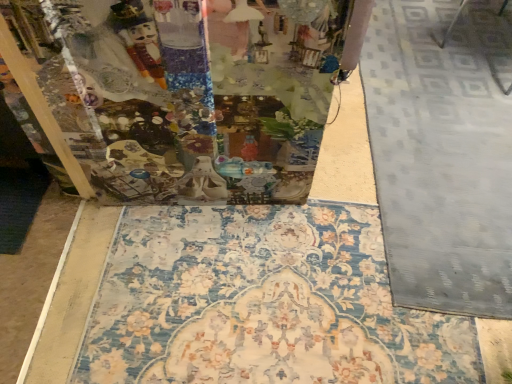
Find the location of a particular element. The width and height of the screenshot is (512, 384). gray textured rug at right is located at coordinates [x=439, y=161].

What do you see at coordinates (439, 161) in the screenshot?
I see `gray textured rug at right` at bounding box center [439, 161].

Where is `floral carpet at center`? floral carpet at center is located at coordinates (262, 303).

What do you see at coordinates (262, 303) in the screenshot? This screenshot has height=384, width=512. I see `floral carpet at center` at bounding box center [262, 303].

Find the location of a particular element. This screenshot has width=512, height=384. gray textured rug at right is located at coordinates (439, 161).

Looking at this image, between floral carpet at center and gray textured rug at right, which one appears on the right side from the viewer's perspective?

gray textured rug at right is more to the right.

Which is behind, floral carpet at center or gray textured rug at right?

gray textured rug at right is behind.

Which point is more forward, (158,223) or (391,289)?

The point (391,289) is closer.

From the image's perspective, which is above, floral carpet at center or gray textured rug at right?

gray textured rug at right, from the image's perspective.

Based on the photo, from a real-world perspective, is floral carpet at center under gray textured rug at right?

Indeed, from a real-world perspective, floral carpet at center is positioned beneath gray textured rug at right.

Considering the sizes of floral carpet at center and gray textured rug at right in the image, is floral carpet at center wider or thinner than gray textured rug at right?

Clearly, floral carpet at center has more width compared to gray textured rug at right.

Is floral carpet at center shorter than gray textured rug at right?

Yes, floral carpet at center is shorter than gray textured rug at right.

Is floral carpet at center smaller than gray textured rug at right?

Yes, floral carpet at center is smaller than gray textured rug at right.

Is floral carpet at center inside or outside of gray textured rug at right?

floral carpet at center exists outside the volume of gray textured rug at right.

Are floral carpet at center and gray textured rug at right beside each other?

No, floral carpet at center is not with gray textured rug at right.

Is floral carpet at center looking in the opposite direction of gray textured rug at right?

That's not correct — floral carpet at center is not looking away from gray textured rug at right.

Measure the distance between floral carpet at center and gray textured rug at right.

floral carpet at center and gray textured rug at right are 20.44 inches apart from each other.

What are the coordinates of `mat below the gray textured rug at right (from the image's perspective)` in the screenshot? It's located at (262, 303).

Which is more to the left, gray textured rug at right or floral carpet at center?

floral carpet at center is more to the left.

Which object is further away from the camera, gray textured rug at right or floral carpet at center?

gray textured rug at right is behind.

Between point (511, 146) and point (186, 345), which one is positioned behind?

The point (511, 146) is behind.

From the image's perspective, is gray textured rug at right located above or below floral carpet at center?

From the image's perspective, gray textured rug at right appears above floral carpet at center.

From a real-world perspective, is gray textured rug at right physically above floral carpet at center?

Correct, in the physical world, gray textured rug at right is higher than floral carpet at center.

In terms of width, does gray textured rug at right look wider or thinner when compared to floral carpet at center?

Clearly, gray textured rug at right has less width compared to floral carpet at center.

Which of these two, gray textured rug at right or floral carpet at center, stands taller?

gray textured rug at right is taller.

From the picture: Which of these two, gray textured rug at right or floral carpet at center, is bigger?

With larger size is gray textured rug at right.

Would you say gray textured rug at right is outside floral carpet at center?

Yes, gray textured rug at right is not within floral carpet at center.

Is gray textured rug at right beside floral carpet at center?

No, gray textured rug at right is not beside floral carpet at center.

Could you tell me if gray textured rug at right is turned towards floral carpet at center?

Yes, gray textured rug at right is aimed at floral carpet at center.

Can you tell me how much gray textured rug at right and floral carpet at center differ in facing direction?

178 degrees.

Locate an element on the screen. The image size is (512, 384). mat lying in front of the gray textured rug at right is located at coordinates (262, 303).

The image size is (512, 384). I want to click on mat below the gray textured rug at right (from a real-world perspective), so [262, 303].

Where is `mat on the left of gray textured rug at right`? The height and width of the screenshot is (384, 512). mat on the left of gray textured rug at right is located at coordinates (262, 303).